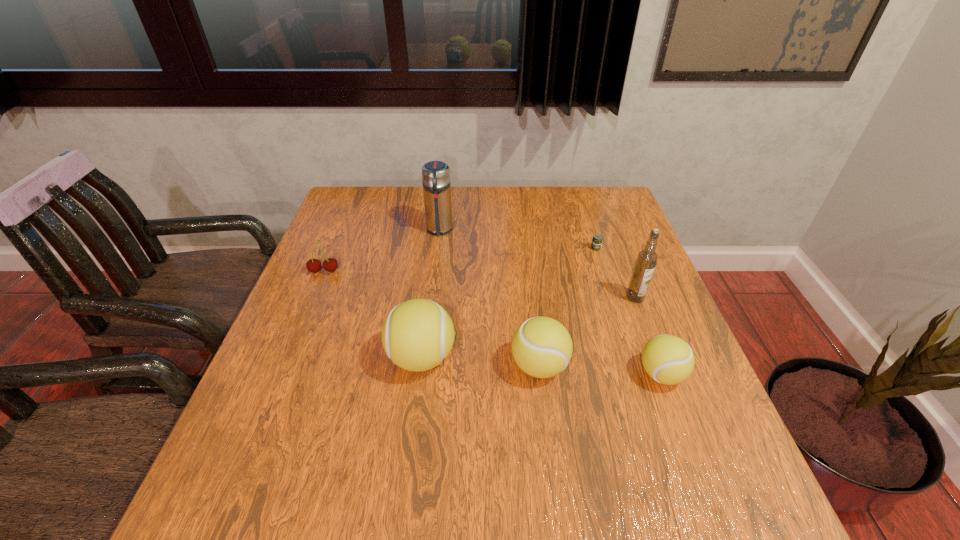
This screenshot has height=540, width=960. In order to click on empty space that is in between the farthest object and the third tallest object in this screenshot , I will do (x=430, y=294).

The image size is (960, 540). I want to click on vacant area between the leftmost object and the rightmost tennis ball, so click(x=492, y=323).

You are a GUI agent. You are given a task and a screenshot of the screen. Output one action in this format:
    pyautogui.click(x=<x>, y=<y>)
    Task: Click on the vacant space that's between the fourth nearest object and the shortest object
    This screenshot has height=540, width=960.
    Given the screenshot: What is the action you would take?
    pyautogui.click(x=615, y=273)

Where is `vacant space that's between the cherry and the thermos bottle`? This screenshot has width=960, height=540. vacant space that's between the cherry and the thermos bottle is located at coordinates (382, 251).

Identify the location of free spot between the vodka and the fourth object from left to right. The image size is (960, 540). (588, 332).

The image size is (960, 540). I want to click on free point between the farthest object and the tallest tennis ball, so click(430, 294).

Locate which object is the sixth closest to the farthest object. Please provide its 2D coordinates. Your answer should be formatted as a tuple, i.e. [(x, y)], where the tuple contains the x and y coordinates of a point satisfying the conditions above.

[(667, 359)]

Point out which object is positioned as the sixth nearest to the third tallest object. Please provide its 2D coordinates. Your answer should be formatted as a tuple, i.e. [(x, y)], where the tuple contains the x and y coordinates of a point satisfying the conditions above.

[(597, 239)]

Select which tennis ball appears as the closest to the beer can. Please provide its 2D coordinates. Your answer should be formatted as a tuple, i.e. [(x, y)], where the tuple contains the x and y coordinates of a point satisfying the conditions above.

[(542, 347)]

Identify which tennis ball is the second nearest to the shortest object. Please provide its 2D coordinates. Your answer should be formatted as a tuple, i.e. [(x, y)], where the tuple contains the x and y coordinates of a point satisfying the conditions above.

[(667, 359)]